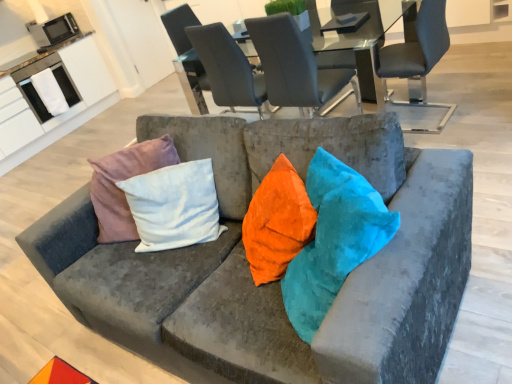
Question: Is suede-like gray chair at upper center, placed as the third chair when sorted from left to right, turned away from metallic microwave at upper left, positioned as the second appliance in bottom-to-top order?

Choices:
 (A) no
 (B) yes

Answer: (A)

Question: Can you confirm if suede-like gray chair at upper center, placed as the third chair when sorted from left to right, is positioned to the left of metallic microwave at upper left, positioned as the second appliance in bottom-to-top order?

Choices:
 (A) yes
 (B) no

Answer: (B)

Question: Can you confirm if suede-like gray chair at upper center, the 2th chair from the right, is taller than metallic microwave at upper left, positioned as the second appliance in bottom-to-top order?

Choices:
 (A) no
 (B) yes

Answer: (B)

Question: Is suede-like gray chair at upper center, placed as the third chair when sorted from left to right, completely or partially outside of metallic microwave at upper left, positioned as the second appliance in bottom-to-top order?

Choices:
 (A) yes
 (B) no

Answer: (A)

Question: Would you say suede-like gray chair at upper center, the 2th chair from the right, contains metallic microwave at upper left, positioned as the second appliance in bottom-to-top order?

Choices:
 (A) yes
 (B) no

Answer: (B)

Question: Would you consider suede-like gray chair at upper center, placed as the third chair when sorted from left to right, to be distant from metallic microwave at upper left, positioned as the second appliance in bottom-to-top order?

Choices:
 (A) no
 (B) yes

Answer: (B)

Question: Is the position of velvet gray chair at center, which ranks as the 2th chair in left-to-right order, less distant than that of matte gray chair at upper center, which is the 1th chair in left-to-right order?

Choices:
 (A) no
 (B) yes

Answer: (B)

Question: Considering the relative sizes of velvet gray chair at center, the third chair when ordered from right to left, and matte gray chair at upper center, which is the 1th chair in left-to-right order, in the image provided, is velvet gray chair at center, the third chair when ordered from right to left, bigger than matte gray chair at upper center, which is the 1th chair in left-to-right order,?

Choices:
 (A) no
 (B) yes

Answer: (A)

Question: Is velvet gray chair at center, which ranks as the 2th chair in left-to-right order, taller than matte gray chair at upper center, which is the 1th chair in left-to-right order?

Choices:
 (A) yes
 (B) no

Answer: (B)

Question: Is velvet gray chair at center, which ranks as the 2th chair in left-to-right order, at the left side of matte gray chair at upper center, which is the 4th chair from right to left?

Choices:
 (A) yes
 (B) no

Answer: (B)

Question: From the image's perspective, is velvet gray chair at center, the third chair when ordered from right to left, below matte gray chair at upper center, which is the 4th chair from right to left?

Choices:
 (A) no
 (B) yes

Answer: (B)

Question: From a real-world perspective, is velvet gray chair at center, which ranks as the 2th chair in left-to-right order, on matte gray chair at upper center, which is the 1th chair in left-to-right order?

Choices:
 (A) no
 (B) yes

Answer: (B)

Question: Is metallic microwave at upper left, positioned as the second appliance in bottom-to-top order, outside of matte gray chair at upper right, marked as the 4th chair in a left-to-right arrangement?

Choices:
 (A) no
 (B) yes

Answer: (B)